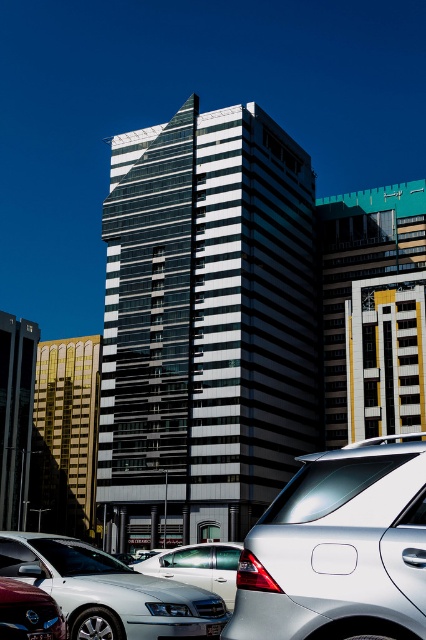
Does point (32, 541) lie behind point (60, 634)?

Yes, point (32, 541) is behind point (60, 634).

Locate an element on the screen. The height and width of the screenshot is (640, 426). silver metallic sedan at lower left is located at coordinates coord(108,589).

Between shiny red car at lower left and black plastic license plate at center, which one appears on the left side from the viewer's perspective?

shiny red car at lower left is more to the left.

The width and height of the screenshot is (426, 640). Describe the element at coordinates (28, 612) in the screenshot. I see `shiny red car at lower left` at that location.

The width and height of the screenshot is (426, 640). I want to click on shiny red car at lower left, so click(x=28, y=612).

Between point (373, 529) and point (221, 544), which one is positioned behind?

The point (221, 544) is behind.

I want to click on satin silver suv at center, so click(339, 548).